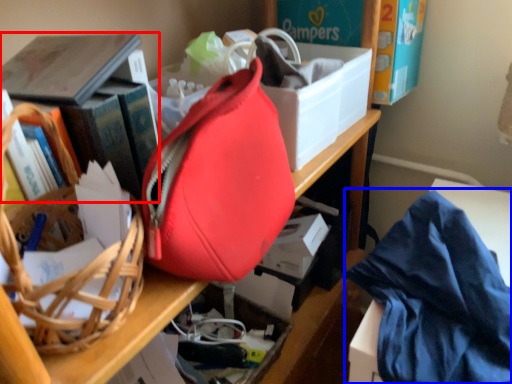
Question: Which object appears farthest to the camera in this image, book (highlighted by a red box) or clothe (highlighted by a blue box)?

Choices:
 (A) book
 (B) clothe

Answer: (A)